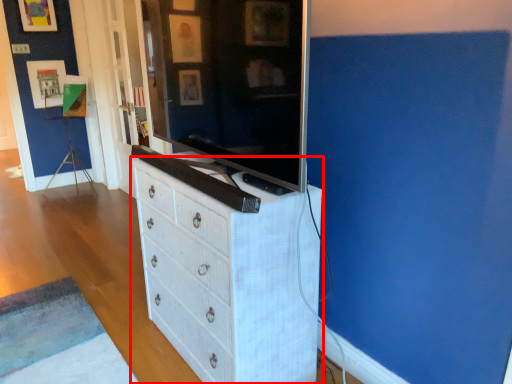
Question: Considering the relative positions of chest of drawers (annotated by the red box) and television in the image provided, where is chest of drawers (annotated by the red box) located with respect to the staircase?

Choices:
 (A) right
 (B) left

Answer: (A)